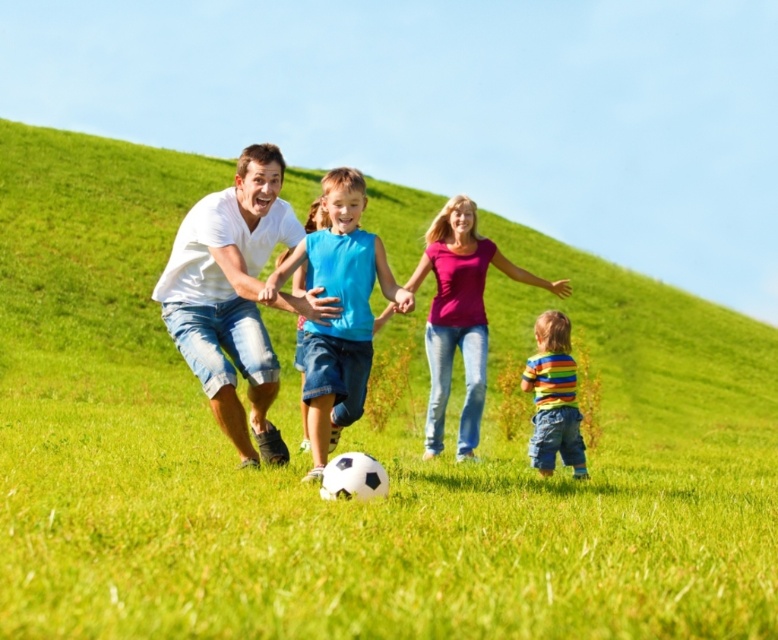
Question: Estimate the real-world distances between objects in this image. Which object is farther from the blue denim shorts at center?

Choices:
 (A) white matte shirt at center
 (B) white cotton shirt at center

Answer: (A)

Question: Based on their relative distances, which object is farther from the striped cotton shirt at lower right?

Choices:
 (A) blue denim shorts at center
 (B) white cotton shirt at center

Answer: (B)

Question: Is the position of blue denim shorts at center less distant than that of striped cotton shirt at lower right?

Choices:
 (A) no
 (B) yes

Answer: (B)

Question: Does white matte shirt at center have a lesser width compared to striped cotton shirt at lower right?

Choices:
 (A) yes
 (B) no

Answer: (B)

Question: Does white cotton shirt at center have a lesser width compared to striped cotton shirt at lower right?

Choices:
 (A) no
 (B) yes

Answer: (A)

Question: Which of these objects is positioned farthest from the white matte shirt at center?

Choices:
 (A) striped cotton shirt at lower right
 (B) white cotton shirt at center
 (C) blue denim shorts at center

Answer: (A)